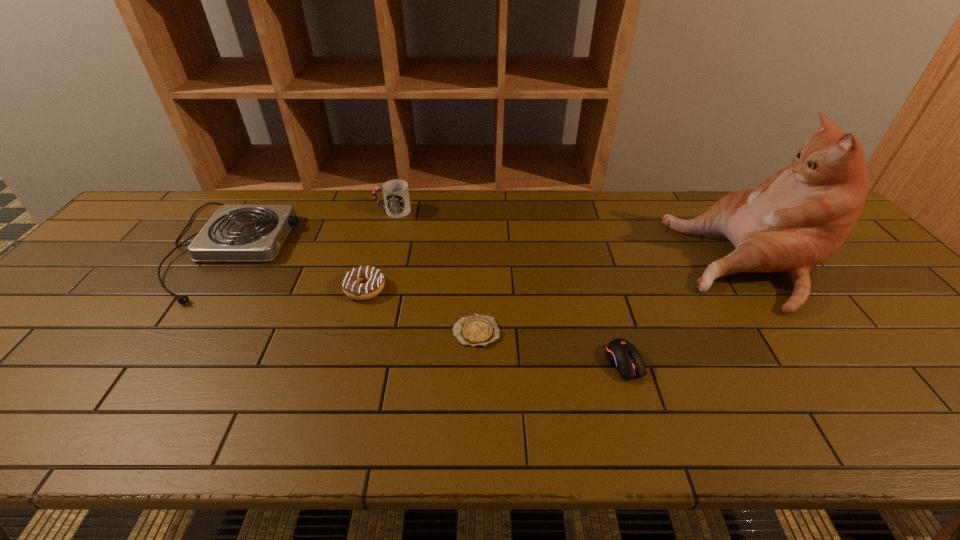
Where is `cup that is at the far edge`? The image size is (960, 540). cup that is at the far edge is located at coordinates (396, 194).

Where is `hotplate that is at the far edge`? The width and height of the screenshot is (960, 540). hotplate that is at the far edge is located at coordinates (236, 232).

In order to click on object that is at the right edge in this screenshot , I will do `click(797, 218)`.

Locate an element on the screen. The height and width of the screenshot is (540, 960). object situated at the far right corner is located at coordinates (797, 218).

Where is `blank space at the far edge of the desktop`? This screenshot has width=960, height=540. blank space at the far edge of the desktop is located at coordinates (322, 200).

I want to click on free space at the near edge of the desktop, so click(732, 407).

You are a GUI agent. You are given a task and a screenshot of the screen. Output one action in this format:
    pyautogui.click(x=<x>, y=<y>)
    Task: Click on the free point at the left edge
    The width and height of the screenshot is (960, 540).
    Given the screenshot: What is the action you would take?
    pos(51,316)

Where is `vacant area at the right edge of the desktop`? The width and height of the screenshot is (960, 540). vacant area at the right edge of the desktop is located at coordinates click(x=874, y=305).

Where is `free space at the far left corner of the desktop`? This screenshot has width=960, height=540. free space at the far left corner of the desktop is located at coordinates (173, 233).

You are a GUI agent. You are given a task and a screenshot of the screen. Output one action in this format:
    pyautogui.click(x=<x>, y=<y>)
    Task: Click on the free point between the quiche and the doughnut
    
    Given the screenshot: What is the action you would take?
    pyautogui.click(x=420, y=310)